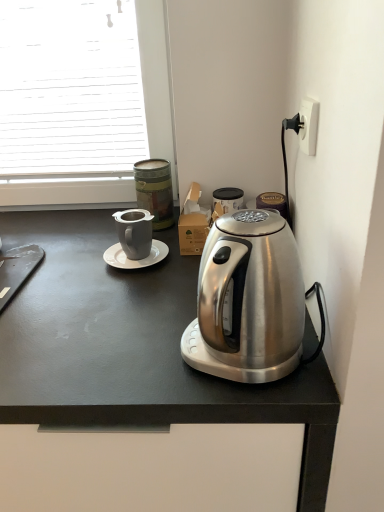
Where is `vacant area situated to the left side of satin silver kettle at right`? vacant area situated to the left side of satin silver kettle at right is located at coordinates (127, 353).